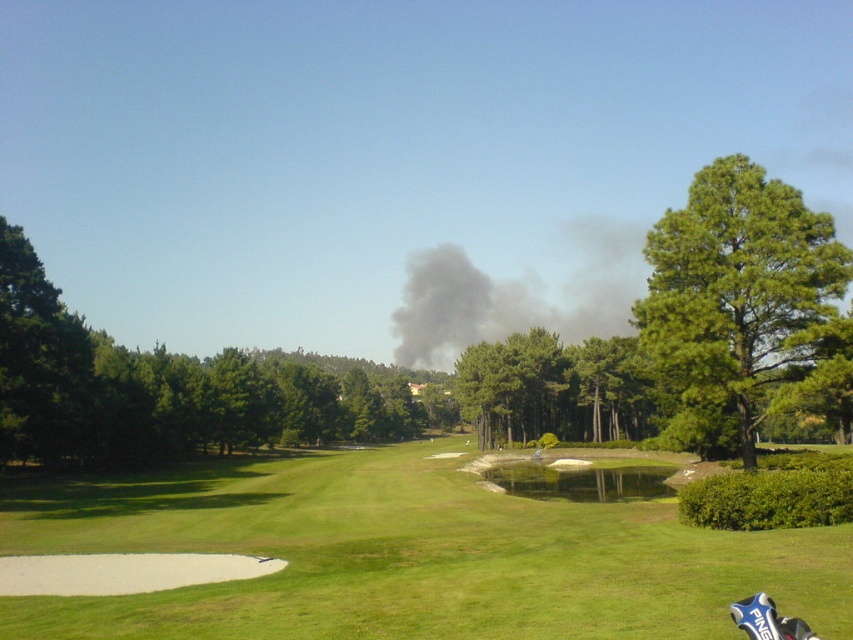
Question: Is green grass at center smaller than green leafy tree at left?

Choices:
 (A) no
 (B) yes

Answer: (A)

Question: Which point appears farthest from the camera in this image?

Choices:
 (A) (340, 456)
 (B) (669, 232)

Answer: (A)

Question: Can you confirm if green grass at center is positioned above green needle-like tree at right?

Choices:
 (A) yes
 (B) no

Answer: (B)

Question: Which object is positioned farthest from the green grass at center?

Choices:
 (A) green needle-like tree at right
 (B) green leafy tree at left

Answer: (A)

Question: Among these points, which one is nearest to the camera?

Choices:
 (A) (28, 372)
 (B) (788, 269)

Answer: (B)

Question: Does green needle-like tree at right come in front of green leafy tree at left?

Choices:
 (A) no
 (B) yes

Answer: (B)